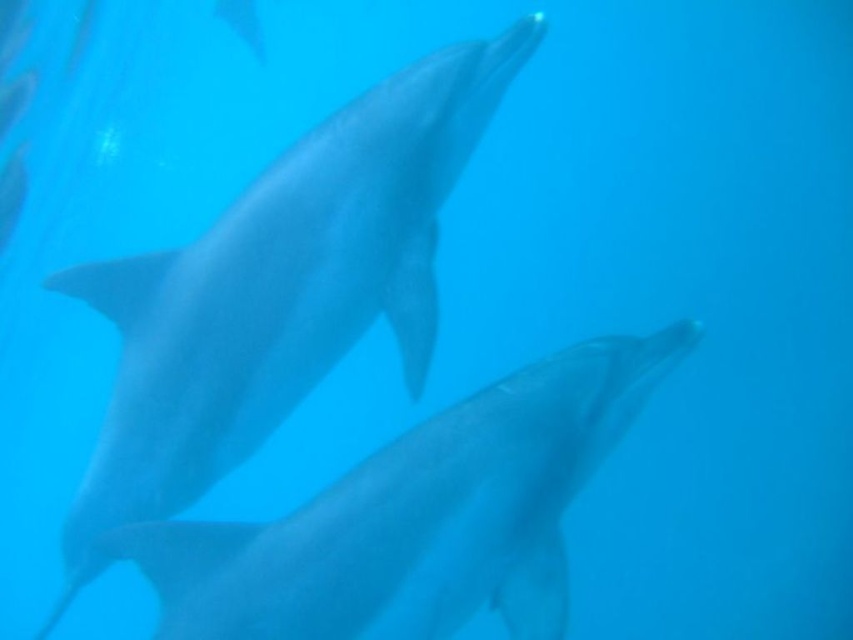
Question: Is sleek gray dolphin at center bigger than smooth gray dolphin at center?

Choices:
 (A) no
 (B) yes

Answer: (B)

Question: Is sleek gray dolphin at center wider than smooth gray dolphin at center?

Choices:
 (A) yes
 (B) no

Answer: (B)

Question: Among these points, which one is nearest to the camera?

Choices:
 (A) (361, 577)
 (B) (135, 445)

Answer: (A)

Question: Which of the following is the farthest from the observer?

Choices:
 (A) smooth gray dolphin at center
 (B) sleek gray dolphin at center

Answer: (B)

Question: Does sleek gray dolphin at center appear on the left side of smooth gray dolphin at center?

Choices:
 (A) no
 (B) yes

Answer: (B)